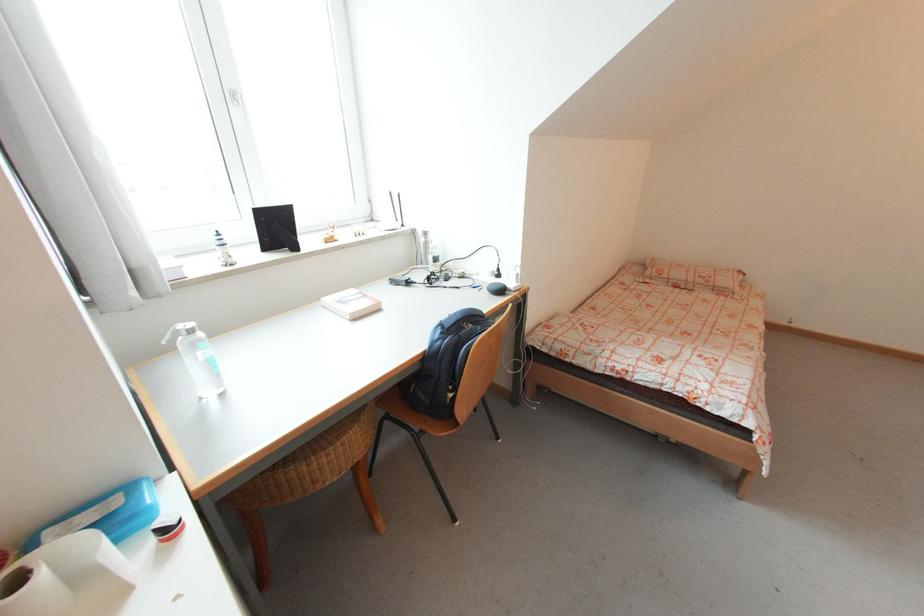
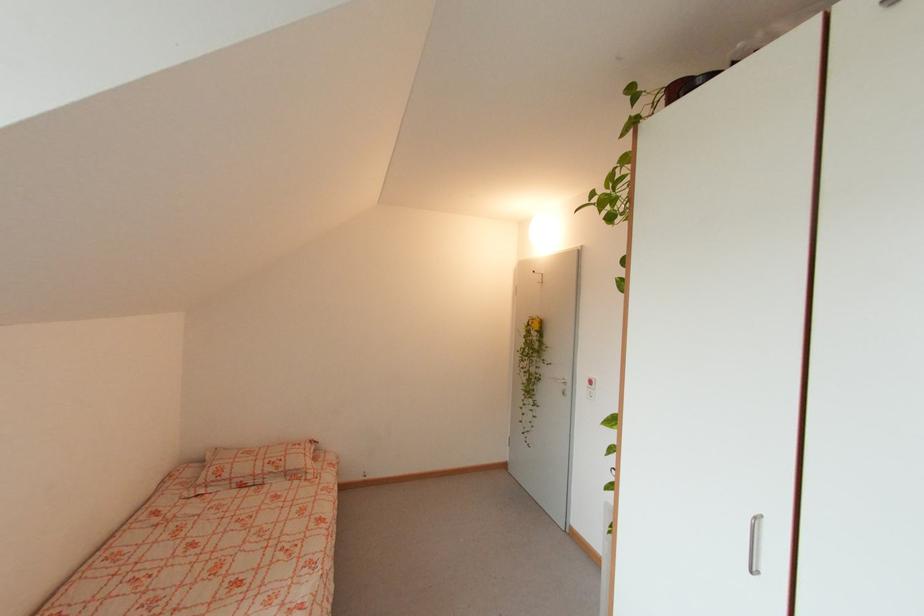
Locate, in the second image, the point that corresponds to point 661,278 in the first image.

(219, 484)